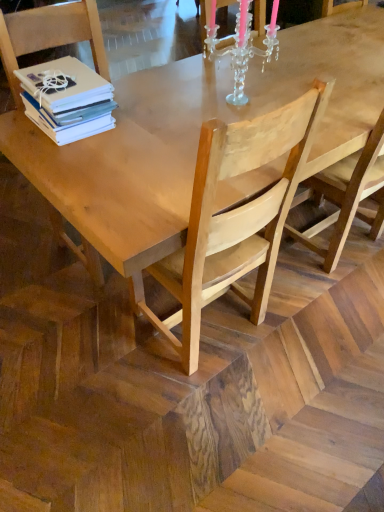
Question: Is white matte stack of books at upper left bigger or smaller than light brown wood chair at left, arranged as the 1th chair when viewed from the left?

Choices:
 (A) big
 (B) small

Answer: (B)

Question: Considering the relative positions of white matte stack of books at upper left and light brown wood chair at left, which ranks as the 2th chair in right-to-left order, in the image provided, is white matte stack of books at upper left to the left or to the right of light brown wood chair at left, which ranks as the 2th chair in right-to-left order,?

Choices:
 (A) right
 (B) left

Answer: (B)

Question: Which object is the farthest from the clear crystal candle holder at upper center?

Choices:
 (A) white matte stack of books at upper left
 (B) light brown wooden chair at center, the 1th chair positioned from the right
 (C) light brown wood chair at left, arranged as the 1th chair when viewed from the left

Answer: (B)

Question: Estimate the real-world distances between objects in this image. Which object is closer to the light brown wood chair at left, arranged as the 1th chair when viewed from the left?

Choices:
 (A) light brown wooden chair at center, the 1th chair positioned from the right
 (B) white matte stack of books at upper left
 (C) clear crystal candle holder at upper center

Answer: (B)